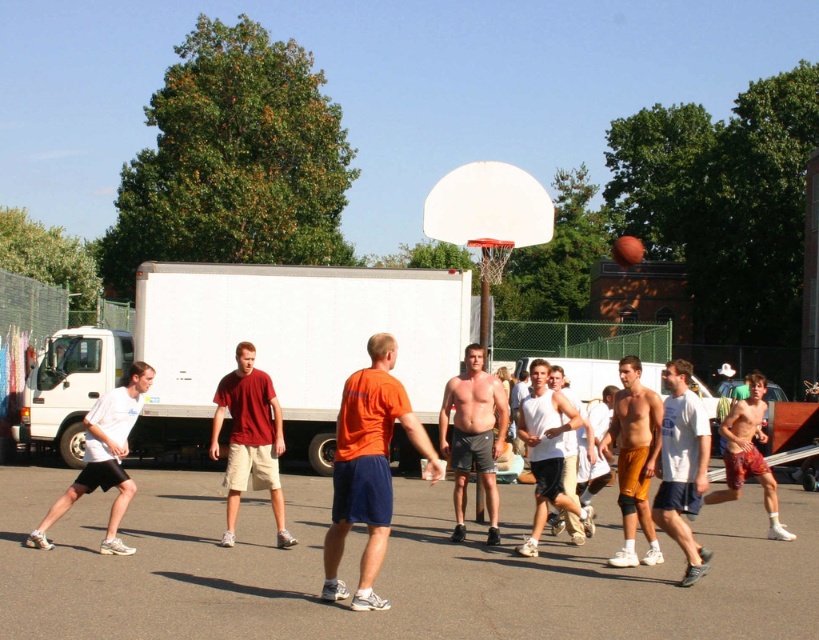
Between point (433, 349) and point (541, 454), which one is positioned in front?

Point (541, 454)

Between point (440, 360) and point (553, 497), which one is positioned behind?

The point (440, 360) is more distant.

The height and width of the screenshot is (640, 819). Identify the location of white matte truck at center. coord(256,349).

Does skinny shirtless torso at center appear under shiny red shorts at right?

Actually, skinny shirtless torso at center is above shiny red shorts at right.

Is point (496, 500) closer to camera compared to point (734, 496)?

Yes.

Where is `skinny shirtless torso at center`? Image resolution: width=819 pixels, height=640 pixels. skinny shirtless torso at center is located at coordinates (473, 435).

Is point (482, 424) positioned behind point (539, 528)?

Yes, it is behind point (539, 528).

Which is below, skinny shirtless torso at center or white matte tank top at center?

Positioned lower is white matte tank top at center.

What do you see at coordinates (473, 435) in the screenshot? I see `skinny shirtless torso at center` at bounding box center [473, 435].

Locate an element on the screen. The image size is (819, 640). skinny shirtless torso at center is located at coordinates (473, 435).